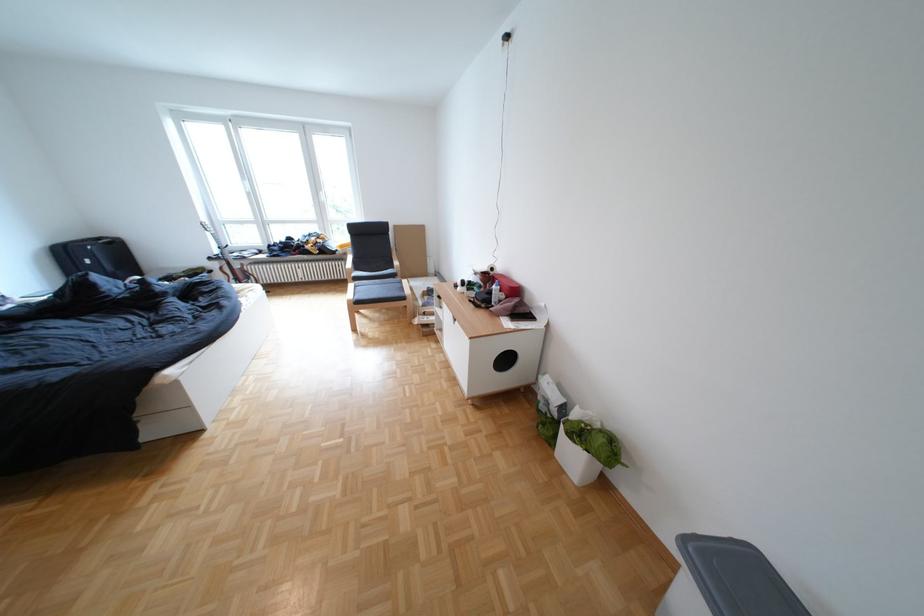
What do you see at coordinates (323, 201) in the screenshot? I see `a white window handle` at bounding box center [323, 201].